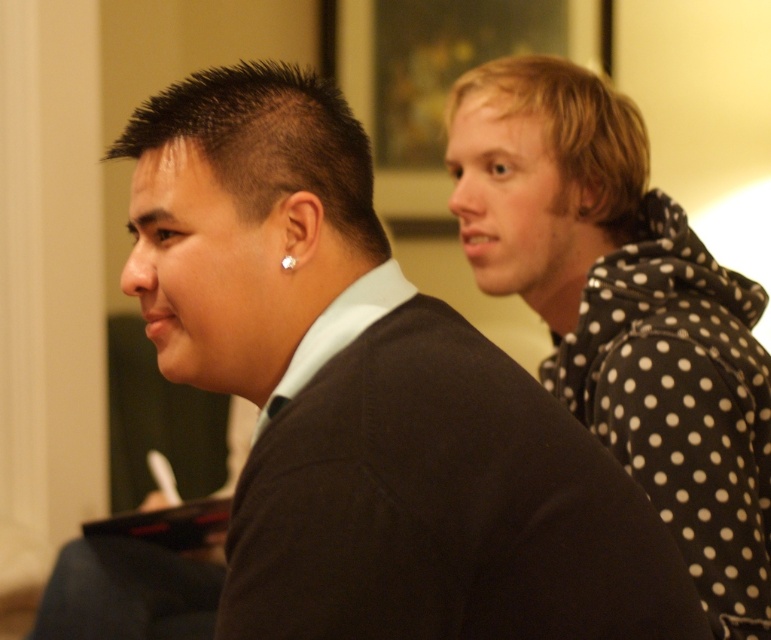
Measure the distance between black polka dot hoodie at right and camera.

1.22 meters

Which of these two, black polka dot hoodie at right or silver metallic earring at left, stands shorter?

Standing shorter between the two is silver metallic earring at left.

Does point (652, 349) lie behind point (288, 262)?

That is True.

Where is `black polka dot hoodie at right`? black polka dot hoodie at right is located at coordinates (625, 308).

Is dark brown knit sweater at center above black polka dot hoodie at right?

No, dark brown knit sweater at center is not above black polka dot hoodie at right.

Locate an element on the screen. The height and width of the screenshot is (640, 771). dark brown knit sweater at center is located at coordinates (436, 496).

Find the location of a particular element. The width and height of the screenshot is (771, 640). dark brown knit sweater at center is located at coordinates coord(436,496).

From the picture: Can you confirm if dark brown knit sweater at center is positioned to the left of silver metallic earring at left?

In fact, dark brown knit sweater at center is to the right of silver metallic earring at left.

Who is shorter, dark brown knit sweater at center or silver metallic earring at left?

With less height is silver metallic earring at left.

Where is `dark brown knit sweater at center`? dark brown knit sweater at center is located at coordinates (x=436, y=496).

Locate an element on the screen. Image resolution: width=771 pixels, height=640 pixels. dark brown knit sweater at center is located at coordinates (436, 496).